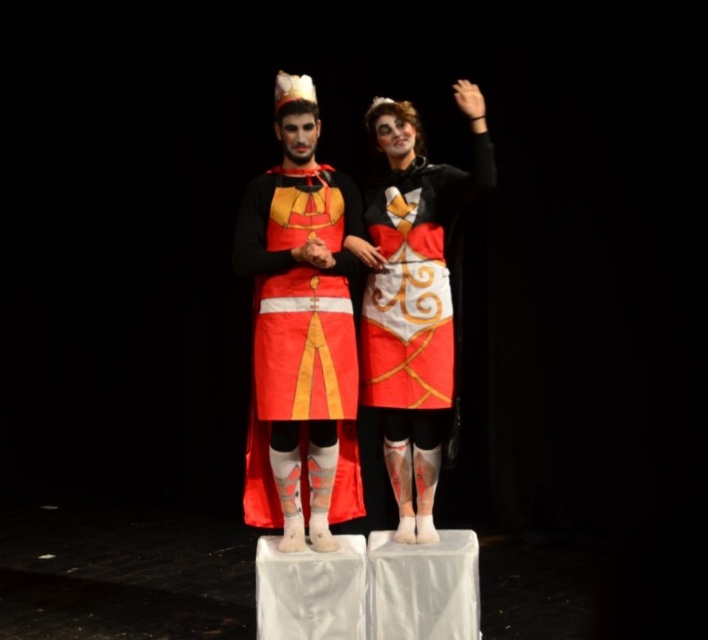
Describe the element at coordinates (413, 298) in the screenshot. I see `matte black costume at center` at that location.

Between matte black costume at center and matte red fabric cape at center, which one appears on the left side from the viewer's perspective?

Positioned to the left is matte red fabric cape at center.

The width and height of the screenshot is (708, 640). I want to click on matte black costume at center, so click(x=413, y=298).

You are a GUI agent. You are given a task and a screenshot of the screen. Output one action in this format:
    pyautogui.click(x=<x>, y=<y>)
    Task: Click on the matte black costume at center
    The height and width of the screenshot is (640, 708).
    Given the screenshot: What is the action you would take?
    click(x=413, y=298)

In the scene shown: Can you confirm if matte red fabric cape at center is taller than matte black hand at center?

Correct, matte red fabric cape at center is much taller as matte black hand at center.

Is matte red fabric cape at center thinner than matte black hand at center?

Incorrect, matte red fabric cape at center's width is not less than matte black hand at center's.

Who is more forward, (266, 328) or (319, 244)?

Point (319, 244) is more forward.

Where is `matte red fabric cape at center`? matte red fabric cape at center is located at coordinates pyautogui.click(x=299, y=330).

Can you confirm if matte black costume at center is shorter than matte black hand at center?

In fact, matte black costume at center may be taller than matte black hand at center.

Is matte black costume at center thinner than matte black hand at center?

In fact, matte black costume at center might be wider than matte black hand at center.

Which is behind, point (445, 353) or point (312, 260)?

The point (445, 353) is more distant.

Locate an element on the screen. Image resolution: width=708 pixels, height=640 pixels. matte black costume at center is located at coordinates [x=413, y=298].